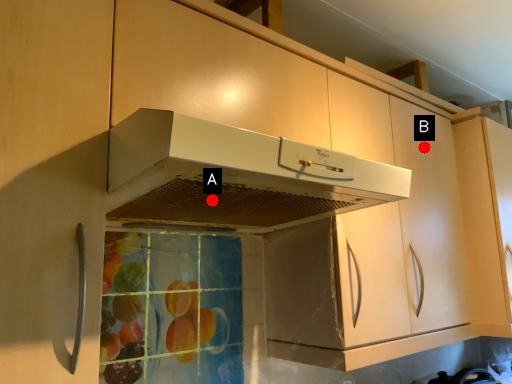
Question: Two points are circled on the image, labeled by A and B beside each circle. Which point is farther from the camera taking this photo?

Choices:
 (A) A is further
 (B) B is further

Answer: (B)